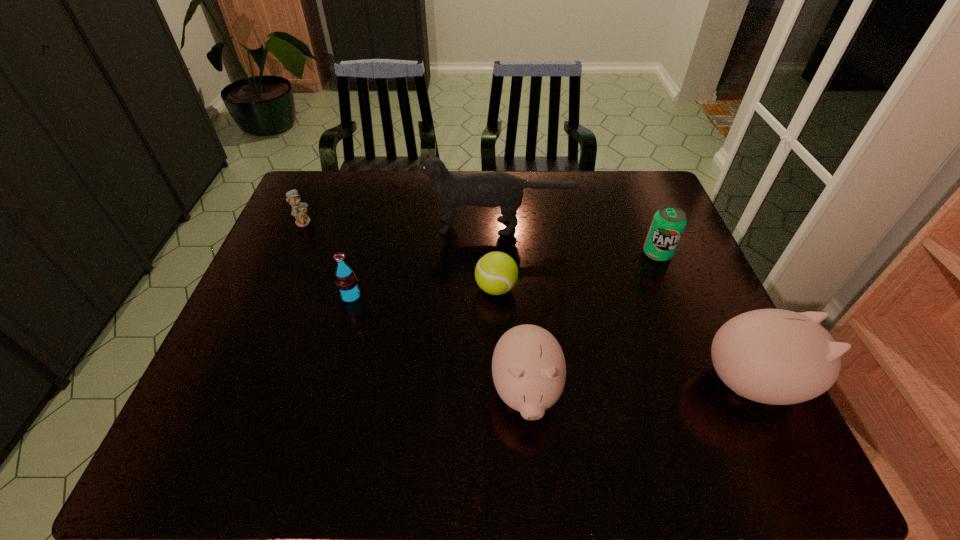
Where is `vacant region between the nearer soda and the teddy bear`? This screenshot has height=540, width=960. vacant region between the nearer soda and the teddy bear is located at coordinates (327, 259).

Find the location of a particular element. The width and height of the screenshot is (960, 540). free space between the second tallest object and the tennis ball is located at coordinates (626, 336).

In order to click on free space between the right soda and the right piggy bank in this screenshot , I will do `click(707, 319)`.

Find the location of `vacant area that lies between the tennis ball and the sixth object from right to left`. vacant area that lies between the tennis ball and the sixth object from right to left is located at coordinates pyautogui.click(x=423, y=292).

Select which object appears as the fifth closest to the sixth object from right to left. Please provide its 2D coordinates. Your answer should be formatted as a tuple, i.e. [(x, y)], where the tuple contains the x and y coordinates of a point satisfying the conditions above.

[(668, 224)]

Locate an element on the screen. the fifth closest object to the left piggy bank is located at coordinates (492, 189).

You are a GUI agent. You are given a task and a screenshot of the screen. Output one action in this format:
    pyautogui.click(x=<x>, y=<y>)
    Task: Click on the vacant position in the image that satisfies the following two spatial constraints: 1. on the front-facing side of the nearer soda; 2. on the right side of the leftmost object
    This screenshot has width=960, height=540.
    Given the screenshot: What is the action you would take?
    pyautogui.click(x=271, y=296)